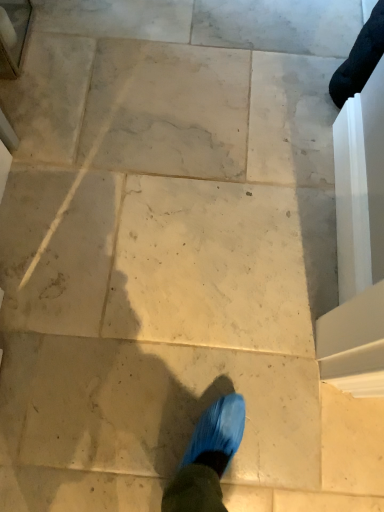
Where is `blank space situated above beige marble floor at center (from a real-world perspective)`? blank space situated above beige marble floor at center (from a real-world perspective) is located at coordinates (172, 432).